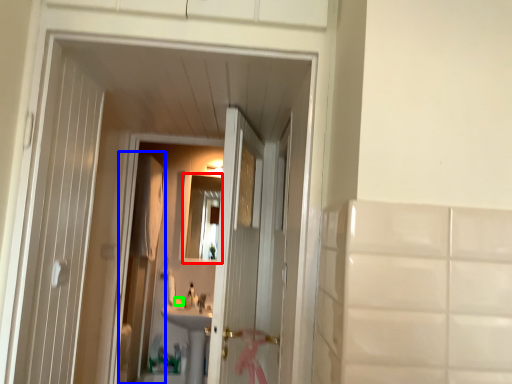
Question: Estimate the real-world distances between objects in this image. Which object is closer to mirror (highlighted by a red box), screen door (highlighted by a blue box) or soap (highlighted by a green box)?

Choices:
 (A) screen door
 (B) soap

Answer: (A)